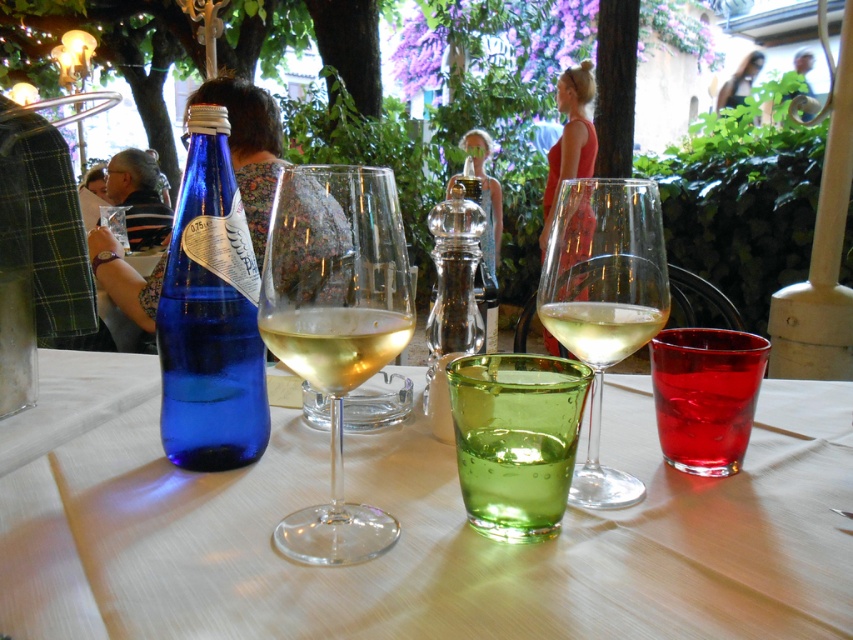
You are setting up a table for a dinner party and need to arrange the translucent glass wine at center and the clear glass pepper shaker at center. Which item should you place first if you want to ensure there is enough space for both?

The translucent glass wine at center occupies less space than the clear glass pepper shaker at center, so you should place the clear glass pepper shaker at center first to ensure there is enough space for both.

You are a customer at the outdoor table and want to place your phone on the table. The green glass at center is in the way. Where should you move it to make space?

Move the green glass at center to a different location on the table since its current position at point (515,440) is blocking the space you need for your phone.

You are a waiter at the outdoor table and need to place a new drink order. The customer wants their drink to be as close as possible to them. Which of the two glasses, the green glass at center or the clear glass wine at center, should you choose to place the drink in?

The green glass at center is closer to the viewer than the clear glass wine at center, so you should place the drink in the green glass at center to be closer to the customer.